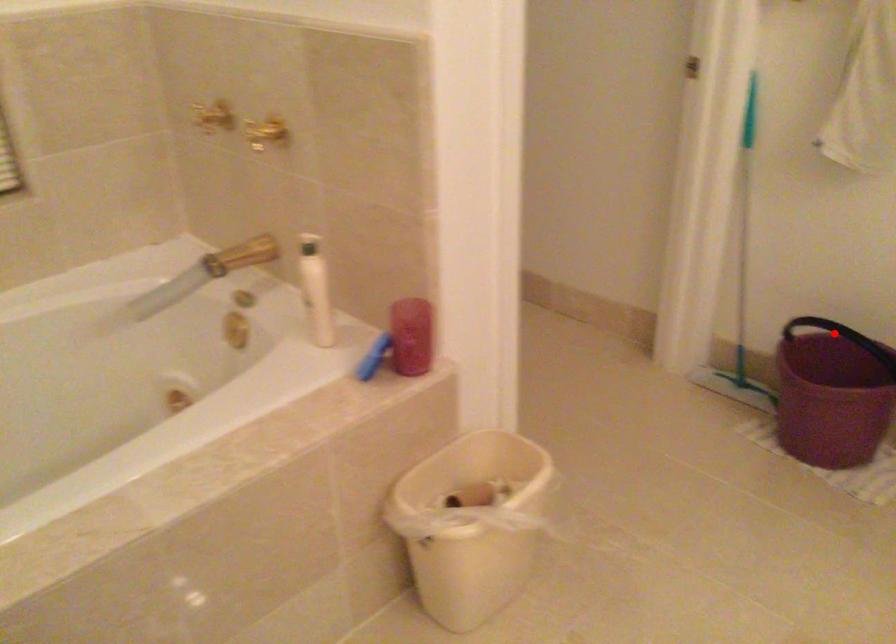
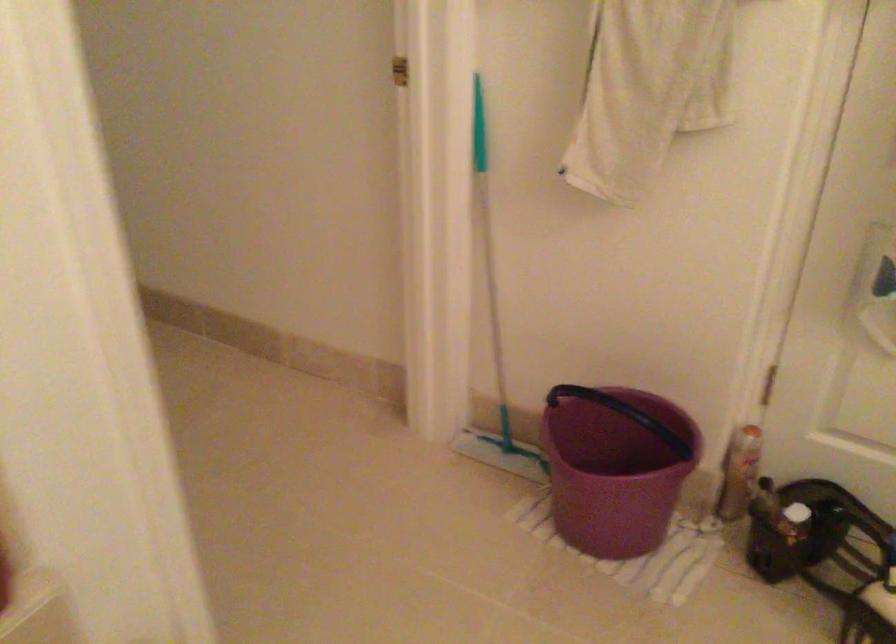
Question: I am providing you with two images of the same scene from different viewpoints. A red point is marked on the first image. At the location where the point appears in image 1, is it still visible in image 2?

Choices:
 (A) Yes
 (B) No

Answer: (B)